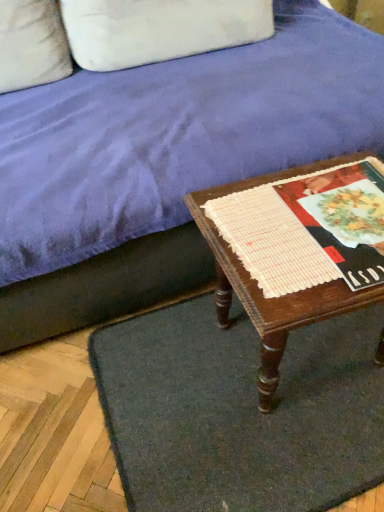
Identify the location of free region under white woven placemat at center (from a real-world perspective). (311, 220).